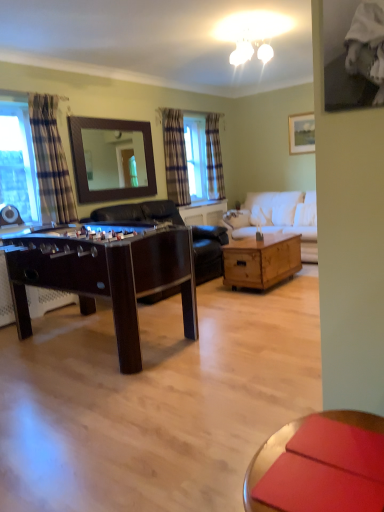
Identify the location of smooth wooden coffee table at lower right. (266, 464).

The width and height of the screenshot is (384, 512). What do you see at coordinates (106, 277) in the screenshot? I see `dark wood foosball table at center, positioned as the second table in right-to-left order` at bounding box center [106, 277].

Measure the distance between clear glass window at left and camera.

The distance of clear glass window at left from camera is 3.89 meters.

What do you see at coordinates (139, 213) in the screenshot? Image resolution: width=384 pixels, height=512 pixels. I see `dark brown leather futon at center` at bounding box center [139, 213].

This screenshot has height=512, width=384. Find the location of `plaid fabric curtain at center, which is the third curtain from front to back`. plaid fabric curtain at center, which is the third curtain from front to back is located at coordinates (214, 158).

Who is bigger, smooth wooden coffee table at lower right or clear glass window at left?

clear glass window at left is bigger.

Considering the relative positions of smooth wooden coffee table at lower right and clear glass window at left in the image provided, is smooth wooden coffee table at lower right to the left or to the right of clear glass window at left?

smooth wooden coffee table at lower right is to the right of clear glass window at left.

Would you say smooth wooden coffee table at lower right contains clear glass window at left?

No, clear glass window at left is not a part of smooth wooden coffee table at lower right.

Can you tell me how much plaid fabric curtain at center, the 2th curtain when ordered from front to back, and plaid fabric curtain at center, which is the 3th curtain in left-to-right order, differ in facing direction?

The angle between the facing direction of plaid fabric curtain at center, the 2th curtain when ordered from front to back, and the facing direction of plaid fabric curtain at center, which is the 3th curtain in left-to-right order, is 0.708 degrees.

In the scene shown: Considering the relative sizes of plaid fabric curtain at center, the 2th curtain from the back, and plaid fabric curtain at center, the 1th curtain in the right-to-left sequence, in the image provided, is plaid fabric curtain at center, the 2th curtain from the back, smaller than plaid fabric curtain at center, the 1th curtain in the right-to-left sequence,?

No.

From the image's perspective, is plaid fabric curtain at center, the 2th curtain viewed from the left, below plaid fabric curtain at center, which is the 3th curtain in left-to-right order?

Yes.

Considering the relative positions of plaid fabric curtain at center, the 2th curtain viewed from the left, and plaid fabric curtain at center, which is the third curtain from front to back, in the image provided, is plaid fabric curtain at center, the 2th curtain viewed from the left, to the right of plaid fabric curtain at center, which is the third curtain from front to back, from the viewer's perspective?

No.

Is white fabric couch at center surrounded by matte wooden picture frame at upper right?

Definitely not — white fabric couch at center is not inside matte wooden picture frame at upper right.

Which of these two, matte wooden picture frame at upper right or white fabric couch at center, is smaller?

Smaller between the two is matte wooden picture frame at upper right.

Looking at this image, which is more distant, (293, 130) or (313, 224)?

The point (293, 130) is farther.

How much distance is there between matte wooden picture frame at upper right and white fabric couch at center?

A distance of 5.25 feet exists between matte wooden picture frame at upper right and white fabric couch at center.

Which point is more distant from viewer, [40,138] or [270,273]?

Positioned behind is point [270,273].

From the image's perspective, which one is positioned lower, plaid fabric curtain at left, which is the third curtain from back to front, or wooden coffee table at center, which is counted as the first table, starting from the back?

wooden coffee table at center, which is counted as the first table, starting from the back, appears lower in the image.

Is plaid fabric curtain at left, which is the third curtain from back to front, far from wooden coffee table at center, which is the 1th table from right to left?

That's right, there is a large distance between plaid fabric curtain at left, which is the third curtain from back to front, and wooden coffee table at center, which is the 1th table from right to left.

Does smooth wooden coffee table at lower right contain matte wooden picture frame at upper right?

No, matte wooden picture frame at upper right is located outside of smooth wooden coffee table at lower right.

Is smooth wooden coffee table at lower right oriented away from matte wooden picture frame at upper right?

No.

Which object is positioned more to the left, smooth wooden coffee table at lower right or matte wooden picture frame at upper right?

smooth wooden coffee table at lower right is more to the left.

Considering the positions of objects dark brown leather futon at center and plaid fabric curtain at left, the 1th curtain when ordered from left to right, in the image provided, who is behind, dark brown leather futon at center or plaid fabric curtain at left, the 1th curtain when ordered from left to right,?

dark brown leather futon at center is behind.

Considering the points (208, 242) and (41, 209), which point is behind, point (208, 242) or point (41, 209)?

The point (208, 242) is farther from the camera.

Could you measure the distance between dark brown leather futon at center and plaid fabric curtain at left, which appears as the first curtain when viewed from the front?

dark brown leather futon at center and plaid fabric curtain at left, which appears as the first curtain when viewed from the front, are 27.43 inches apart from each other.

Does plaid fabric curtain at left, acting as the 3th curtain starting from the right, turn towards plaid fabric curtain at center, which is the third curtain from front to back?

No, plaid fabric curtain at left, acting as the 3th curtain starting from the right, does not turn towards plaid fabric curtain at center, which is the third curtain from front to back.

From a real-world perspective, is plaid fabric curtain at left, which appears as the first curtain when viewed from the front, physically located above or below plaid fabric curtain at center, which is the 1th curtain in back-to-front order?

plaid fabric curtain at left, which appears as the first curtain when viewed from the front, is below plaid fabric curtain at center, which is the 1th curtain in back-to-front order.

From the image's perspective, which curtain is the 2nd one below the plaid fabric curtain at center, the 1th curtain in the right-to-left sequence? Please provide its 2D coordinates.

[(50, 162)]

Locate an element on the screen. coffee table that is below the clear glass window at left (from the image's perspective) is located at coordinates (x=266, y=464).

The height and width of the screenshot is (512, 384). Identify the location of curtain that is the 1st one when counting leftward from the plaid fabric curtain at center, the 1th curtain in the right-to-left sequence. (175, 157).

From the image, which object appears to be nearer to dark wood foosball table at center, the first table when ordered from front to back, matte wooden picture frame at upper right or plaid fabric curtain at center, which is the 3th curtain in left-to-right order?

The object closer to dark wood foosball table at center, the first table when ordered from front to back, is plaid fabric curtain at center, which is the 3th curtain in left-to-right order.

Consider the image. Estimate the real-world distances between objects in this image. Which object is further from wooden framed mirror at upper center, plaid fabric curtain at center, arranged as the second curtain when viewed from the right, or wooden coffee table at center, which is the 1th table from right to left?

The object further to wooden framed mirror at upper center is wooden coffee table at center, which is the 1th table from right to left.

Considering their positions, is dark brown leather futon at center positioned further to wooden coffee table at center, the second table in the left-to-right sequence, than clear glass window at left?

Based on the image, clear glass window at left appears to be further to wooden coffee table at center, the second table in the left-to-right sequence.

Estimate the real-world distances between objects in this image. Which object is further from white fabric couch at center, smooth wooden coffee table at lower right or wooden framed mirror at upper center?

smooth wooden coffee table at lower right lies further to white fabric couch at center than the other object.

From the image, which object appears to be farther from smooth wooden coffee table at lower right, wooden framed mirror at upper center or dark brown leather futon at center?

Among the two, wooden framed mirror at upper center is located further to smooth wooden coffee table at lower right.

When comparing their distances from plaid fabric curtain at center, the 2th curtain when ordered from front to back, does plaid fabric curtain at left, which appears as the first curtain when viewed from the front, or white fabric couch at center seem further?

Among the two, plaid fabric curtain at left, which appears as the first curtain when viewed from the front, is located further to plaid fabric curtain at center, the 2th curtain when ordered from front to back.

Looking at the image, which one is located further to dark wood foosball table at center, which appears as the first table when viewed from the left, white fabric couch at center or plaid fabric curtain at center, which is the third curtain from front to back?

The object further to dark wood foosball table at center, which appears as the first table when viewed from the left, is plaid fabric curtain at center, which is the third curtain from front to back.

When comparing their distances from dark wood foosball table at center, the first table when ordered from front to back, does wooden coffee table at center, which is the 1th table from right to left, or plaid fabric curtain at center, the 2th curtain from the back, seem further?

plaid fabric curtain at center, the 2th curtain from the back, is further to dark wood foosball table at center, the first table when ordered from front to back.

Image resolution: width=384 pixels, height=512 pixels. I want to click on window located between dark wood foosball table at center, positioned as the 2th table in back-to-front order, and plaid fabric curtain at left, the 1th curtain when ordered from left to right, in the depth direction, so click(18, 157).

Where is `futon between dark wood foosball table at center, the first table when ordered from front to back, and wooden framed mirror at upper center in the front-back direction`? futon between dark wood foosball table at center, the first table when ordered from front to back, and wooden framed mirror at upper center in the front-back direction is located at coordinates (139, 213).

At what (x,y) coordinates should I click in order to perform the action: click on futon positioned between smooth wooden coffee table at lower right and plaid fabric curtain at center, arranged as the second curtain when viewed from the right, from near to far. Please return your answer as a coordinate pair (x, y). Looking at the image, I should click on (139, 213).

The height and width of the screenshot is (512, 384). I want to click on window between dark wood foosball table at center, the first table when ordered from front to back, and wooden framed mirror at upper center, along the z-axis, so click(x=18, y=157).